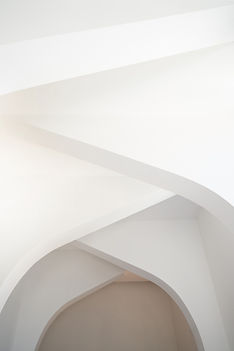
Locate an element on the screen. corner between back wall and right side wall above second lowest shelf is located at coordinates (195, 218).